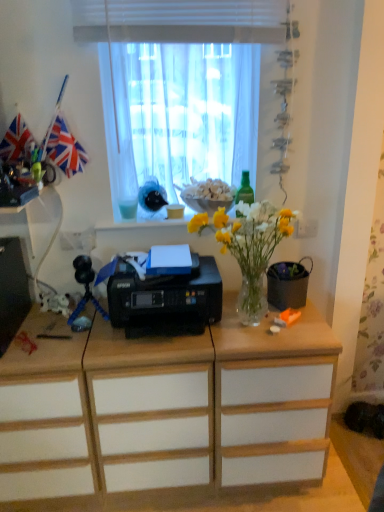
Question: Is black plastic printer at center to the left or to the right of green glass bottle at upper center in the image?

Choices:
 (A) left
 (B) right

Answer: (A)

Question: Is point (195, 290) closer or farther from the camera than point (248, 181)?

Choices:
 (A) farther
 (B) closer

Answer: (B)

Question: Which object is the farthest from the white wood drawer at center, the second drawer from the right?

Choices:
 (A) translucent glass vase at center
 (B) black plastic printer at center
 (C) red fabric flag at upper left
 (D) green glass bottle at upper center
 (E) white sheer curtain at upper center

Answer: (D)

Question: Estimate the real-world distances between objects in this image. Which object is closer to the black plastic printer at center?

Choices:
 (A) white matte drawer at center, placed as the second drawer when sorted from left to right
 (B) translucent glass vase at center
 (C) red fabric flag at upper left
 (D) white wood drawer at center, which is counted as the first drawer, starting from the left
 (E) green glass bottle at upper center

Answer: (B)